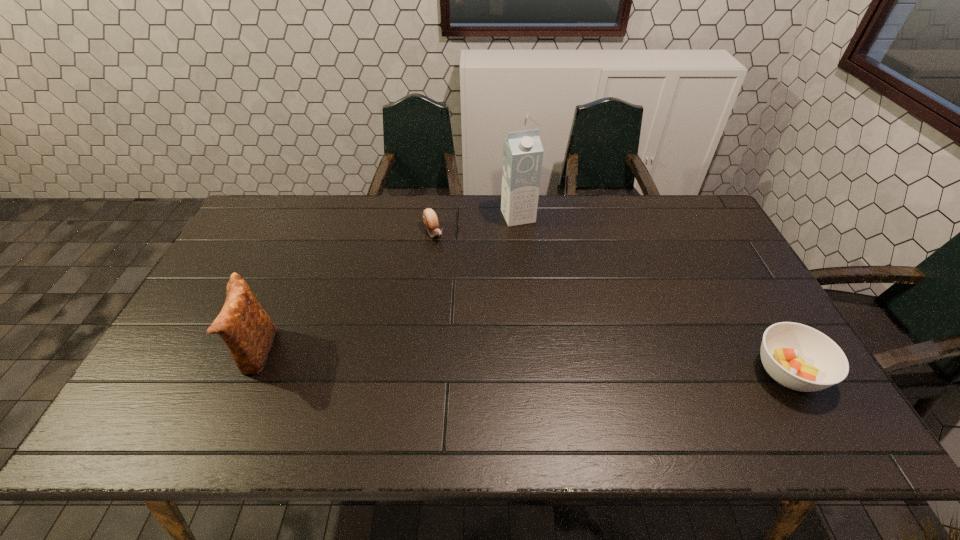
Identify the location of the leftmost object. This screenshot has height=540, width=960. (245, 327).

Locate an element on the screen. The height and width of the screenshot is (540, 960). clutch bag is located at coordinates (245, 327).

This screenshot has width=960, height=540. Identify the location of soup bowl. (799, 357).

Identify the location of the third object from left to right. pyautogui.click(x=522, y=152).

The width and height of the screenshot is (960, 540). Find the location of `the tallest object`. the tallest object is located at coordinates (522, 152).

Where is `the second object from left to right`? Image resolution: width=960 pixels, height=540 pixels. the second object from left to right is located at coordinates (430, 219).

Find the location of a particular element. The width and height of the screenshot is (960, 540). the shortest object is located at coordinates (430, 219).

Find the location of a particular element. The image size is (960, 540). free point located on the open side of the leftmost object is located at coordinates (185, 353).

This screenshot has height=540, width=960. I want to click on vacant space located on the open side of the leftmost object, so click(201, 353).

Image resolution: width=960 pixels, height=540 pixels. I want to click on vacant space located on the open side of the leftmost object, so click(189, 353).